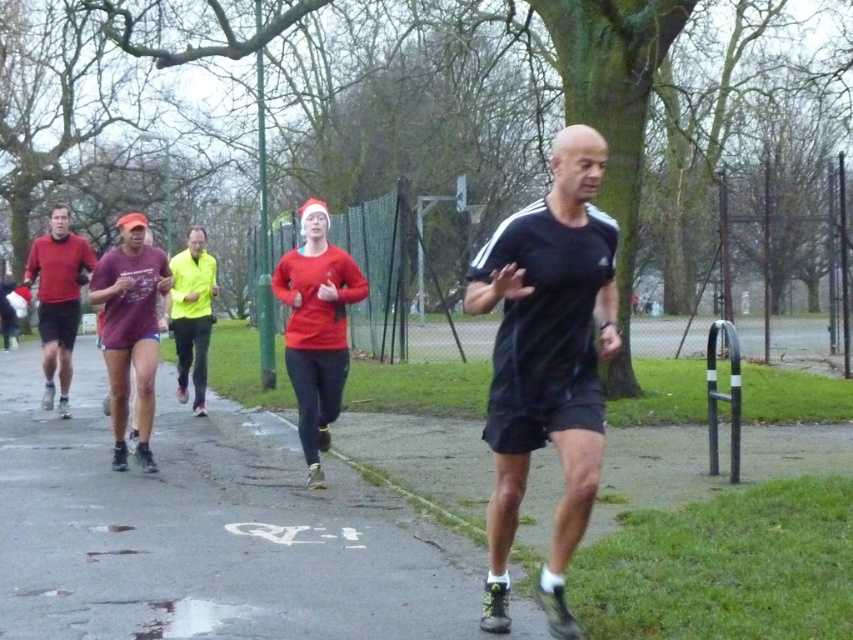
Question: Which is farther from the smooth asphalt path at center?

Choices:
 (A) red matte sweater at center
 (B) matte red shirt at left
 (C) neon yellow jacket at center

Answer: (C)

Question: Does matte red shirt at left lie in front of neon yellow jacket at center?

Choices:
 (A) yes
 (B) no

Answer: (A)

Question: Estimate the real-world distances between objects in this image. Which object is closer to the red matte sweater at center?

Choices:
 (A) matte purple shorts at center
 (B) neon yellow jacket at center

Answer: (A)

Question: Can you confirm if smooth asphalt path at center is positioned to the right of red matte sweater at center?

Choices:
 (A) yes
 (B) no

Answer: (A)

Question: Which point appears farthest from the camera in this image?

Choices:
 (A) (288, 554)
 (B) (202, 416)
 (C) (558, 147)

Answer: (B)

Question: Does smooth asphalt path at center have a greater width compared to black matte running shoe at center?

Choices:
 (A) no
 (B) yes

Answer: (B)